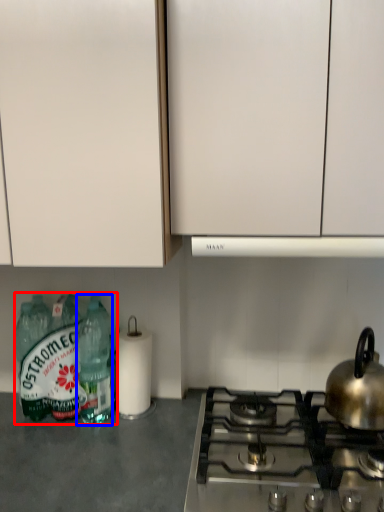
Question: Which object is further to the camera taking this photo, bottle (highlighted by a red box) or bottle (highlighted by a blue box)?

Choices:
 (A) bottle
 (B) bottle

Answer: (A)